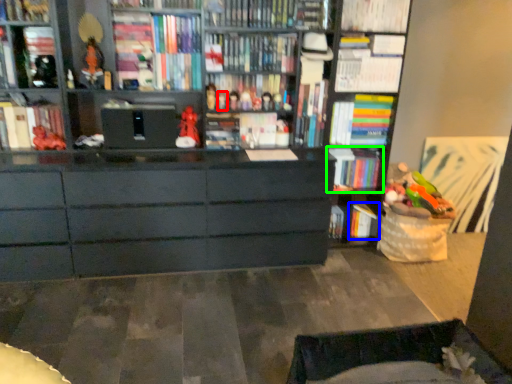
Question: Based on their relative distances, which object is nearer to toy (highlighted by a red box)? Choose from book (highlighted by a blue box) and book (highlighted by a green box).

Choices:
 (A) book
 (B) book

Answer: (B)